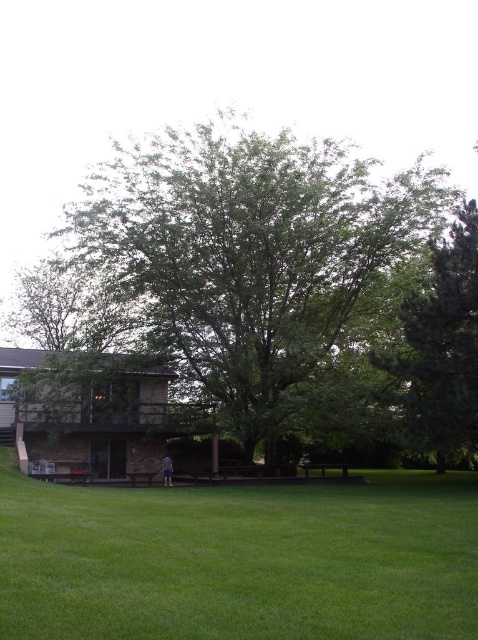
Between green grass at center and green leafy tree at right, which one is positioned higher?

Positioned higher is green grass at center.

Which is in front, point (314, 586) or point (456, 394)?

Point (314, 586) is more forward.

This screenshot has width=478, height=640. In order to click on green grass at center in this screenshot , I will do `click(239, 561)`.

Does point (47, 301) come closer to viewer compared to point (334, 596)?

No, it is behind (334, 596).

Is green leafy tree at center thinner than green grass at center?

No.

Is point (232, 260) less distant than point (405, 636)?

No, it is not.

The width and height of the screenshot is (478, 640). I want to click on green leafy tree at center, so click(x=234, y=273).

Does green leafy tree at center have a greater width compared to green leafy tree at right?

Yes, green leafy tree at center is wider than green leafy tree at right.

Which is behind, point (173, 300) or point (458, 276)?

The point (173, 300) is more distant.

In order to click on green leafy tree at center in this screenshot , I will do `click(234, 273)`.

This screenshot has height=640, width=478. In order to click on green leafy tree at center in this screenshot , I will do `click(234, 273)`.